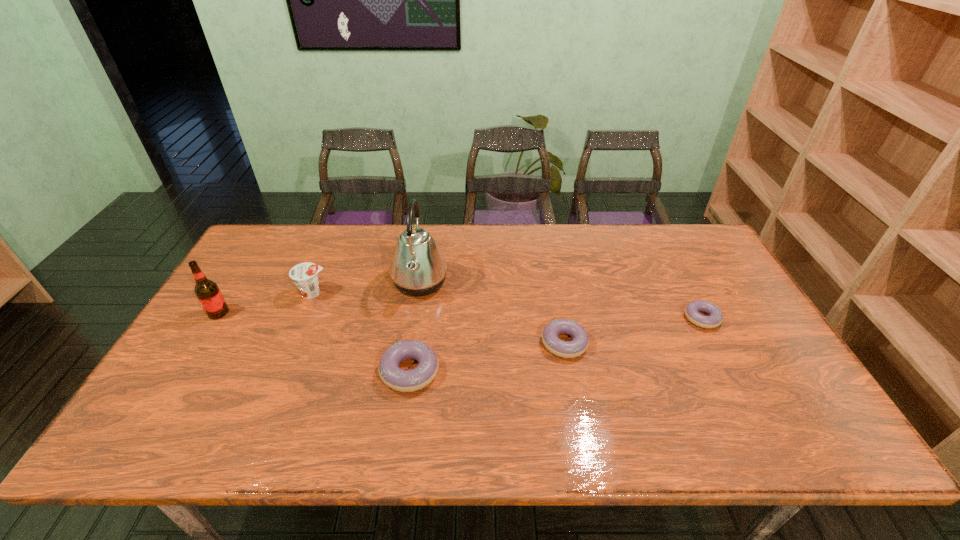
This screenshot has width=960, height=540. In order to click on free space between the second tallest doughnut and the rightmost object in this screenshot , I will do `click(633, 330)`.

At what (x,y) coordinates should I click in order to perform the action: click on free space between the rightmost object and the second tallest doughnut. Please return your answer as a coordinate pair (x, y). This screenshot has height=540, width=960. Looking at the image, I should click on (633, 330).

Identify the location of free area in between the fourth shortest object and the tallest object. (367, 288).

In order to click on vacant space that's between the fifth object from left to right and the shortest doughnut in this screenshot , I will do `click(633, 330)`.

I want to click on free spot between the leftmost object and the tallest object, so click(x=319, y=298).

Select which object appears as the third closest to the fifth tallest object. Please provide its 2D coordinates. Your answer should be formatted as a tuple, i.e. [(x, y)], where the tuple contains the x and y coordinates of a point satisfying the conditions above.

[(692, 310)]

Select which object appears as the closest to the kettle. Please provide its 2D coordinates. Your answer should be formatted as a tuple, i.e. [(x, y)], where the tuple contains the x and y coordinates of a point satisfying the conditions above.

[(394, 377)]

I want to click on doughnut that is the closest to the kettle, so click(394, 377).

Locate which doughnut is the second closest to the leftmost doughnut. Please provide its 2D coordinates. Your answer should be formatted as a tuple, i.e. [(x, y)], where the tuple contains the x and y coordinates of a point satisfying the conditions above.

[(692, 310)]

Where is `vacant space that satisfies the following two spatial constraints: 1. from the spout of the kettle; 2. on the right side of the tallest doughnut`? This screenshot has height=540, width=960. vacant space that satisfies the following two spatial constraints: 1. from the spout of the kettle; 2. on the right side of the tallest doughnut is located at coordinates (406, 371).